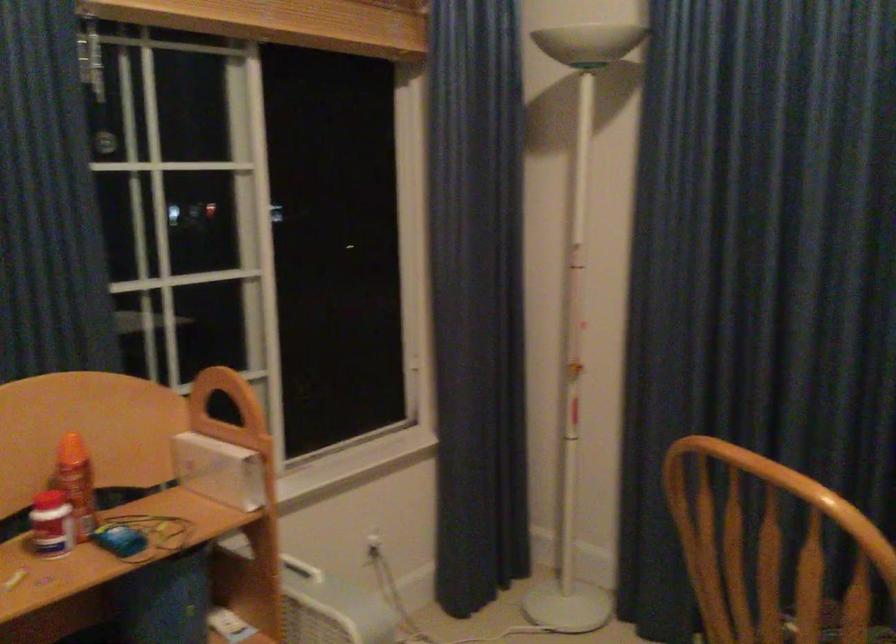
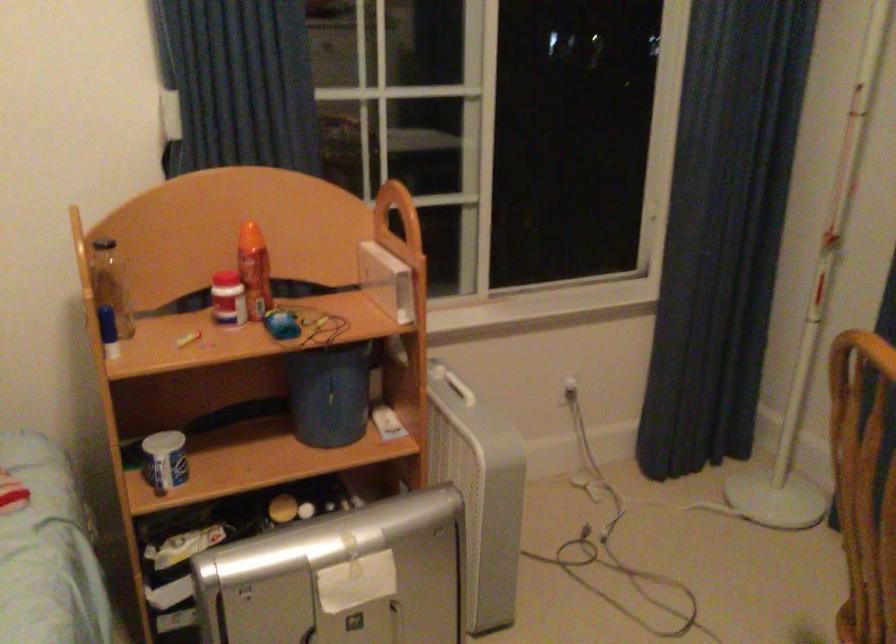
In the second image, find the point that corresponds to point (85, 478) in the first image.

(254, 270)